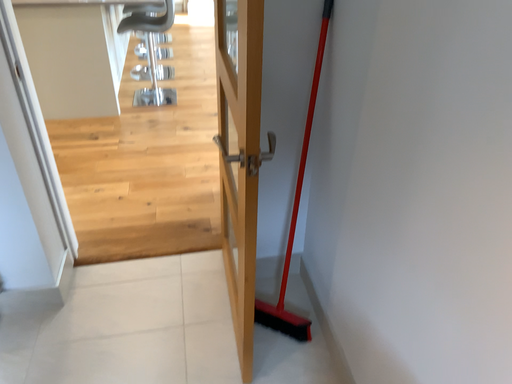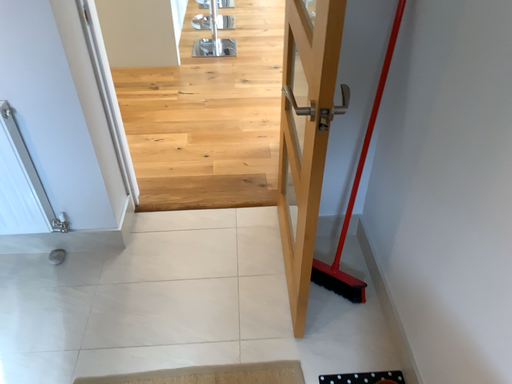
Question: How did the camera likely rotate when shooting the video?

Choices:
 (A) rotated left
 (B) rotated right

Answer: (A)